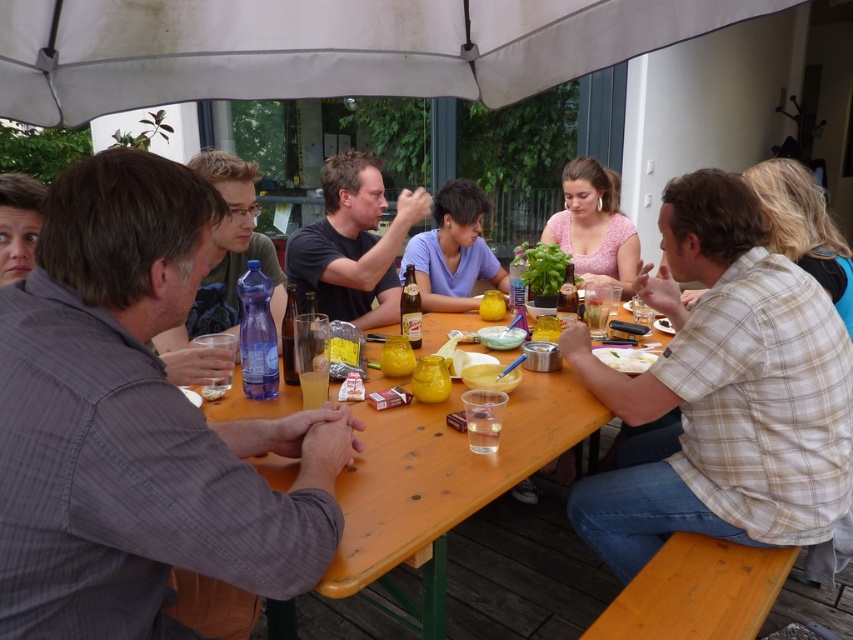
Does light brown plaid shirt at right have a lesser height compared to translucent glass beer at table center?

No, light brown plaid shirt at right is not shorter than translucent glass beer at table center.

Can you confirm if light brown plaid shirt at right is taller than translucent glass beer at table center?

Correct, light brown plaid shirt at right is much taller as translucent glass beer at table center.

Between point (642, 504) and point (412, 314), which one is positioned in front?

Point (642, 504) is more forward.

The width and height of the screenshot is (853, 640). What are the coordinates of `light brown plaid shirt at right` in the screenshot? It's located at (722, 394).

Between wooden table at center and white matte plate at lower right, which one appears on the left side from the viewer's perspective?

Positioned to the left is wooden table at center.

Who is more forward, (276, 401) or (643, 368)?

Point (276, 401)

Identify the location of wooden table at center. (444, 477).

Where is `wooden table at center`? This screenshot has height=640, width=853. wooden table at center is located at coordinates (444, 477).

Between light brown plaid shirt at right and matte plastic water bottle at left, which one has less height?

matte plastic water bottle at left is shorter.

Is point (663, 209) in front of point (216, 323)?

That is True.

I want to click on light brown plaid shirt at right, so click(x=722, y=394).